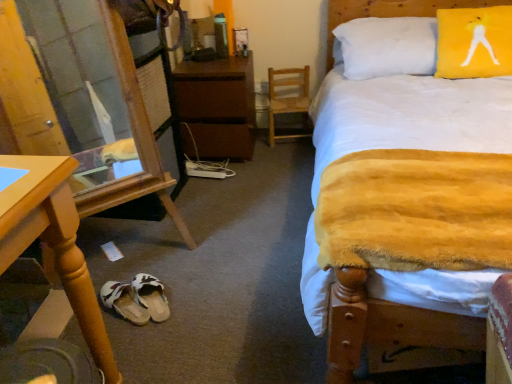
Question: Do you think yellow fabric pillow at upper right is within brown matte nightstand at center, or outside of it?

Choices:
 (A) outside
 (B) inside

Answer: (A)

Question: Looking at their shapes, would you say yellow fabric pillow at upper right is wider or thinner than brown matte nightstand at center?

Choices:
 (A) thin
 (B) wide

Answer: (A)

Question: Which is farther from the yellow plush blanket at center?

Choices:
 (A) wooden desk at lower left
 (B) yellow fabric pillow at upper right
 (C) white fabric sandals at lower center, placed as the first footwear when sorted from left to right
 (D) white fabric slipper at lower center, which appears as the first footwear when viewed from the right
 (E) transparent glass door at lower left

Answer: (A)

Question: Which object is positioned farthest from the wooden desk at lower left?

Choices:
 (A) yellow fabric pillow at upper right
 (B) white fabric sandals at lower center, placed as the first footwear when sorted from left to right
 (C) brown matte nightstand at center
 (D) transparent glass door at lower left
 (E) wooden swivel chair at center

Answer: (A)